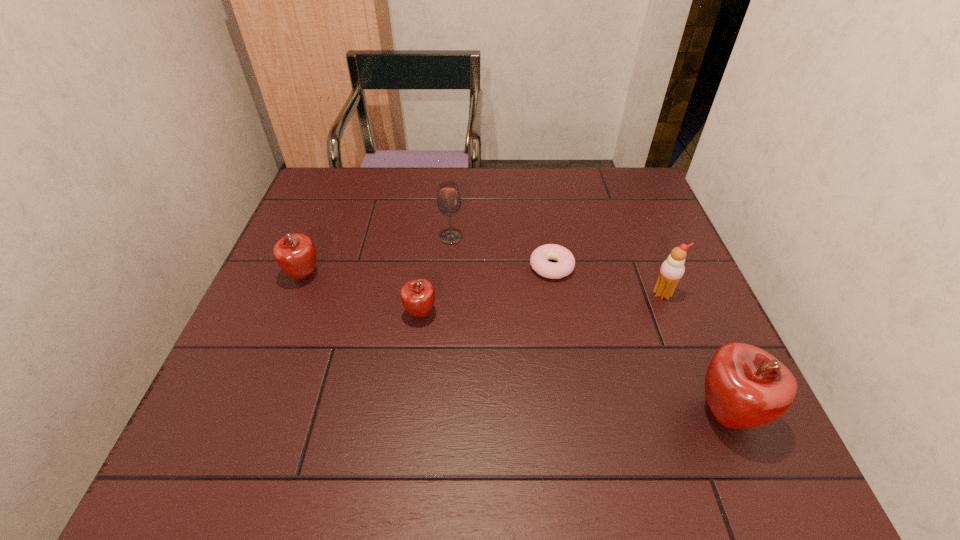
This screenshot has width=960, height=540. Identify the location of location for an additional apple to make spacing equal. (559, 359).